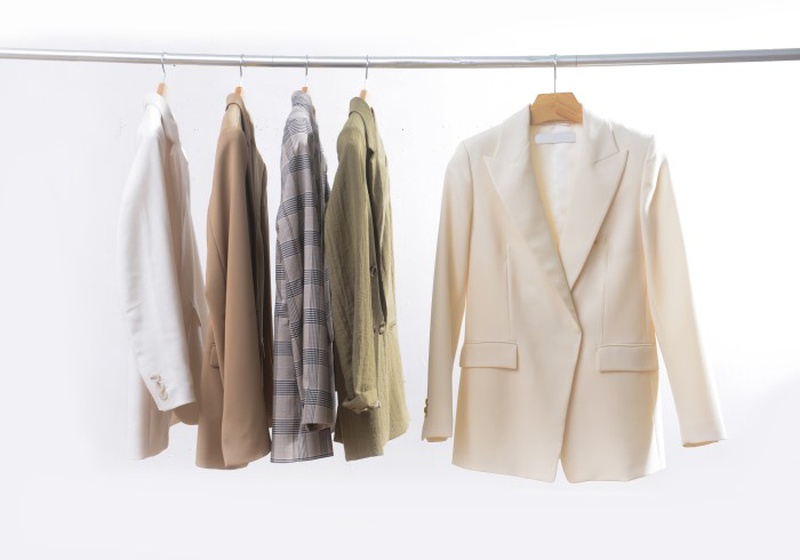
You are a GUI agent. You are given a task and a screenshot of the screen. Output one action in this format:
    pyautogui.click(x=<x>, y=<y>)
    Task: Click on the hangers
    Image resolution: width=800 pixels, height=560 pixels.
    Given the screenshot: What is the action you would take?
    pyautogui.click(x=160, y=74), pyautogui.click(x=241, y=88), pyautogui.click(x=306, y=88), pyautogui.click(x=368, y=84), pyautogui.click(x=566, y=82)